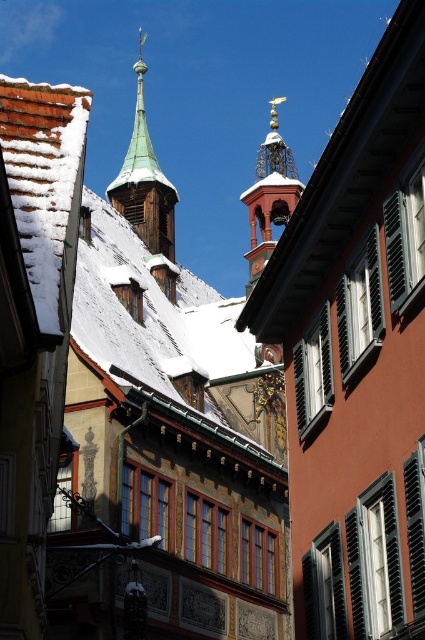
Who is taller, smooth red tile roof at upper center or green copper spire at upper left?

With more height is green copper spire at upper left.

Does smooth red tile roof at upper center appear under green copper spire at upper left?

Indeed, smooth red tile roof at upper center is positioned under green copper spire at upper left.

From the picture: Who is more forward, (374, 141) or (127, 180)?

Point (374, 141) is more forward.

I want to click on smooth red tile roof at upper center, so click(343, 177).

Describe the element at coordinates (170, 328) in the screenshot. I see `snow-covered wooden roof at center` at that location.

You are a GUI agent. You are given a task and a screenshot of the screen. Output one action in this format:
    pyautogui.click(x=<x>, y=<y>)
    Task: Click on the snow-covered wooden roof at center
    The width and height of the screenshot is (425, 640).
    Given the screenshot: What is the action you would take?
    pyautogui.click(x=170, y=328)

Can you confirm if green copper spire at upper left is thinner than polished brass bell tower at center?

Incorrect, green copper spire at upper left's width is not less than polished brass bell tower at center's.

Which is more to the right, green copper spire at upper left or polished brass bell tower at center?

Positioned to the right is polished brass bell tower at center.

You are a GUI agent. You are given a task and a screenshot of the screen. Output one action in this format:
    pyautogui.click(x=<x>, y=<y>)
    Task: Click on the green copper spire at upper left
    This screenshot has width=425, height=640.
    Given the screenshot: What is the action you would take?
    pyautogui.click(x=144, y=182)